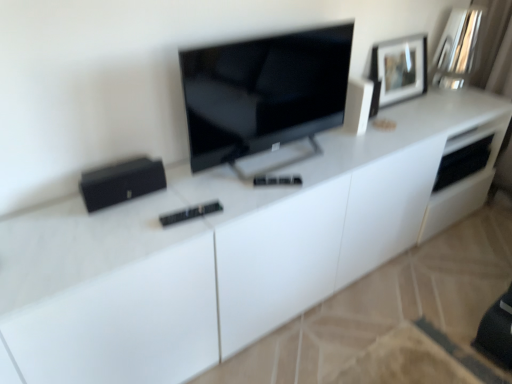
I want to click on free area below matte black tv at center (from a real-world perspective), so click(277, 164).